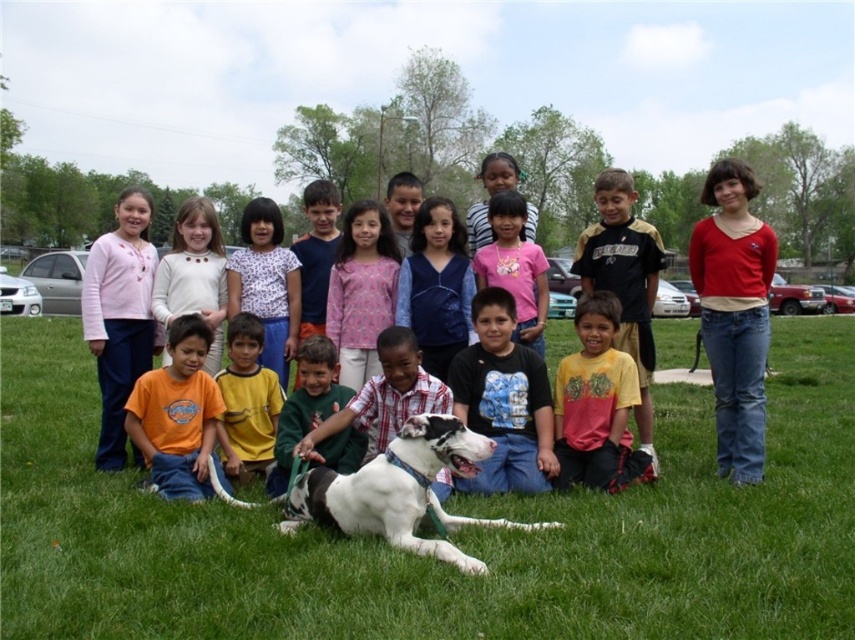
You are a photographer trying to capture a shot of the pink fabric shirt at center. Given that your camera has a focal point at coordinates 0.5, 0.5, will the shirt be in focus?

The pink fabric shirt at center is located at point (x=361, y=291), which is close to the camera focal point at (x=427, y=320). Therefore, the shirt will be in focus.

You are a photographer trying to capture a clear shot of the green fleece shirt at center and the white cotton shirt at center. Which shirt is blocking the view of the other?

The green fleece shirt at center is behind the white cotton shirt at center, so the white cotton shirt at center is blocking the view of the green fleece shirt at center.

You are a photographer trying to capture a group photo of the children. You notice the red cotton shirt at right and the matte striped shirt at center. Which child should you move to the left to ensure both shirts are centered in the frame?

You should move the red cotton shirt at right to the left because it is currently on the right side of the matte striped shirt at center, so shifting it left would help center both shirts in the frame.